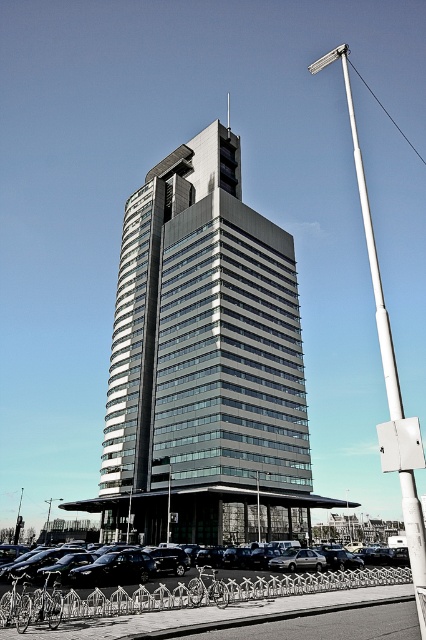
Does metallic glass tower at center have a lesser height compared to metallic silver car at center?

Incorrect, metallic glass tower at center's height does not fall short of metallic silver car at center's.

Does metallic glass tower at center come behind metallic silver car at center?

Yes, metallic glass tower at center is behind metallic silver car at center.

Is point (141, 372) positioned after point (46, 554)?

Yes.

You are a GUI agent. You are given a task and a screenshot of the screen. Output one action in this format:
    pyautogui.click(x=<x>, y=<y>)
    Task: Click on the metallic glass tower at center
    The width and height of the screenshot is (426, 640).
    Given the screenshot: What is the action you would take?
    pyautogui.click(x=201, y=352)

Between metallic glass tower at center and black asphalt parking lot at lower center, which one appears on the right side from the viewer's perspective?

From the viewer's perspective, black asphalt parking lot at lower center appears more on the right side.

Which is in front, point (224, 387) or point (345, 586)?

Point (345, 586)

Find the location of a particular element. metallic glass tower at center is located at coordinates (201, 352).

Does point (65, 595) come closer to viewer compared to point (69, 550)?

That is True.

Where is `black asphalt parking lot at lower center`? black asphalt parking lot at lower center is located at coordinates (311, 582).